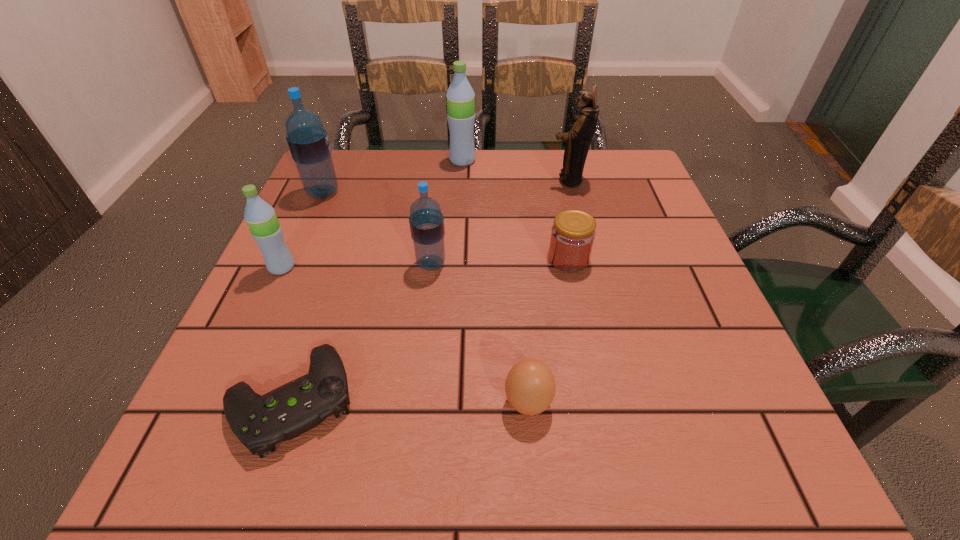
I want to click on object at the far right corner, so click(578, 140).

Locate an element on the screen. This screenshot has width=960, height=540. vacant point at the far edge is located at coordinates (483, 159).

Identify the location of free spot at the near edge of the desktop. (346, 443).

The height and width of the screenshot is (540, 960). In the image, there is a desktop. What are the coordinates of `free space at the left edge` in the screenshot? It's located at (263, 336).

Locate an element on the screen. vacant space at the right edge of the desktop is located at coordinates (744, 366).

In the image, there is a desktop. Find the location of `vacant space at the far right corner`. vacant space at the far right corner is located at coordinates (585, 179).

Locate an element on the screen. vacant space that is in between the brown boiled egg and the jam is located at coordinates (548, 330).

You are a GUI agent. You are given a task and a screenshot of the screen. Output one action in this format:
    pyautogui.click(x=<x>, y=<y>)
    Task: Click on the free space between the nearer green water bottle and the right blue water bottle
    
    Given the screenshot: What is the action you would take?
    pyautogui.click(x=356, y=265)

Find the location of a particular element. This screenshot has height=540, width=960. free area in between the farther blue water bottle and the right green water bottle is located at coordinates (393, 177).

Locate an element on the screen. The height and width of the screenshot is (540, 960). free space between the left blue water bottle and the shortest object is located at coordinates (307, 296).